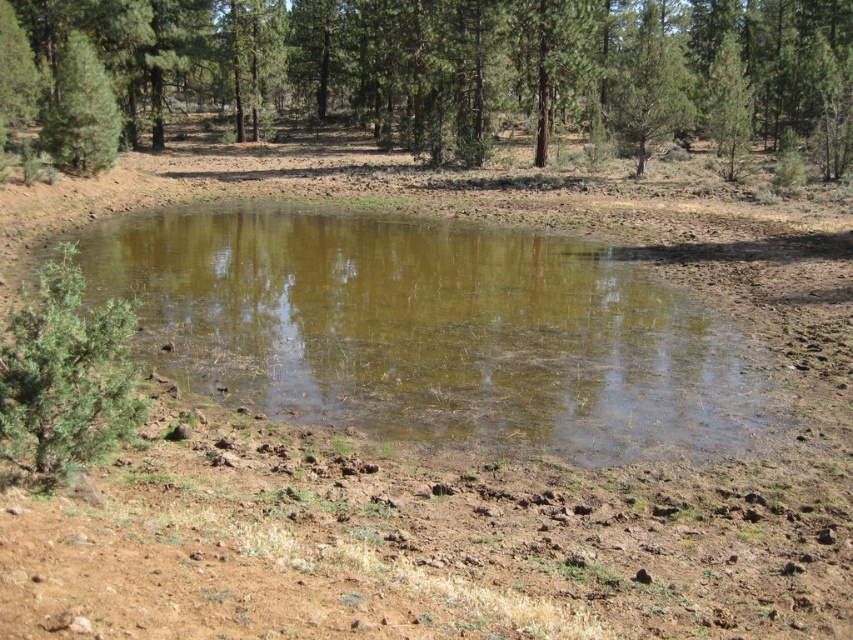
Can you confirm if green matte tree at upper center is positioned to the left of green matte tree at upper right?

Correct, you'll find green matte tree at upper center to the left of green matte tree at upper right.

Image resolution: width=853 pixels, height=640 pixels. What do you see at coordinates (646, 77) in the screenshot?
I see `green matte tree at upper center` at bounding box center [646, 77].

Which is behind, point (611, 116) or point (750, 93)?

The point (611, 116) is more distant.

Locate an element on the screen. green matte tree at upper center is located at coordinates (646, 77).

Can you confirm if brown murky water at center is positioned below green textured tree at upper center?

Yes, brown murky water at center is below green textured tree at upper center.

Can you confirm if brown murky water at center is taller than green textured tree at upper center?

No, brown murky water at center is not taller than green textured tree at upper center.

Where is `brown murky water at center`? Image resolution: width=853 pixels, height=640 pixels. brown murky water at center is located at coordinates (428, 330).

Describe the element at coordinates (480, 65) in the screenshot. I see `green textured tree at upper center` at that location.

Does green textured tree at upper center have a greater height compared to green matte tree at upper left?

Yes.

At what (x,y) coordinates should I click in order to perform the action: click on green textured tree at upper center. Please return your answer as a coordinate pair (x, y). This screenshot has height=640, width=853. Looking at the image, I should click on (480, 65).